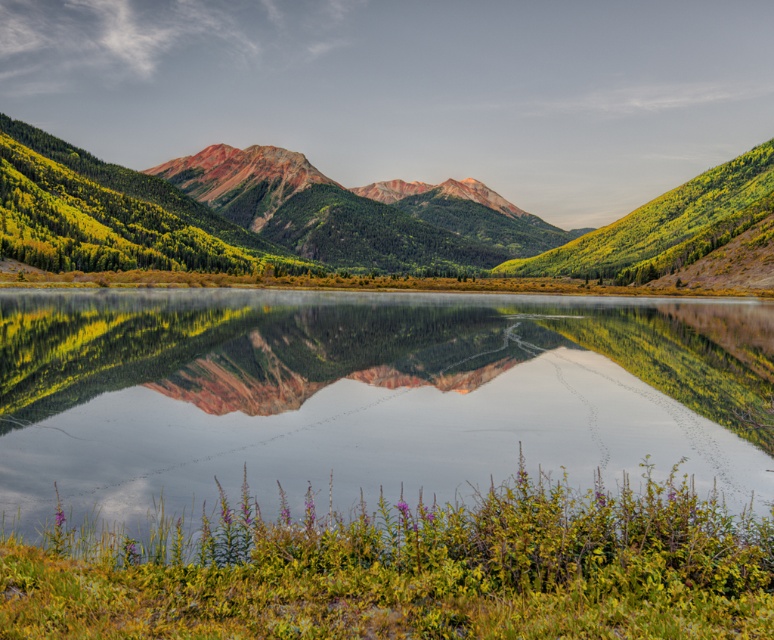
Does green grassy shore at lower center appear on the left side of matte red rock mountain range at center?

Correct, you'll find green grassy shore at lower center to the left of matte red rock mountain range at center.

Does point (368, 340) lie behind point (341, 250)?

No, it is in front of (341, 250).

Who is more distant from viewer, (444, 362) or (324, 236)?

The point (324, 236) is behind.

Identify the location of green grassy shore at lower center. (367, 396).